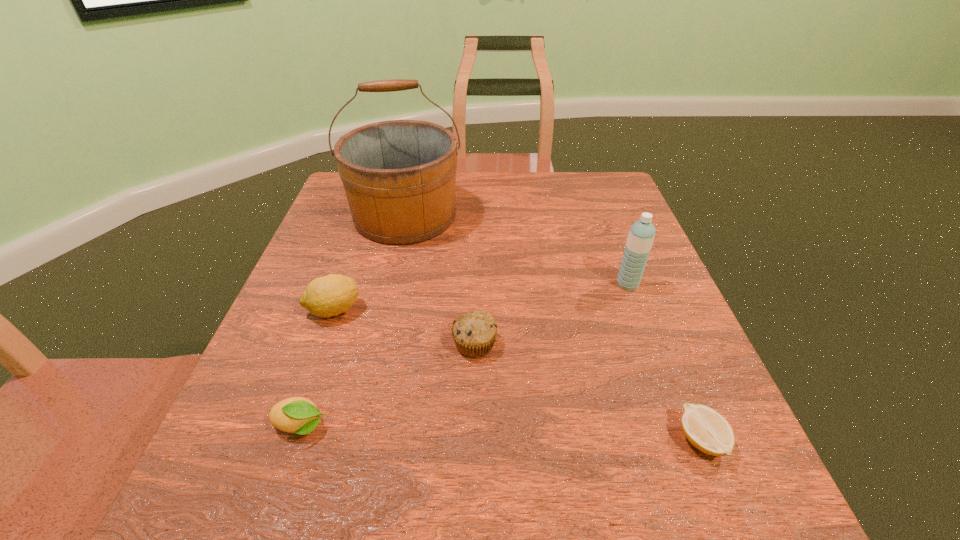
Locate an element on the screen. This screenshot has height=540, width=960. object that is at the far left corner is located at coordinates (399, 176).

The height and width of the screenshot is (540, 960). In the image, there is a desktop. In order to click on free space at the far edge in this screenshot , I will do `click(542, 204)`.

Identify the location of blank space at the near edge. The width and height of the screenshot is (960, 540). (554, 526).

Locate an element on the screen. The width and height of the screenshot is (960, 540). free space at the left edge is located at coordinates (351, 276).

Identify the location of vacant space at the right edge of the desktop. (614, 291).

Identify the location of vacant space at the far right corner of the desktop. (610, 197).

Identify the location of vacant area at the near right corner of the desktop. (693, 486).

I want to click on blank region between the farthest lemon and the rightmost lemon, so click(517, 375).

The image size is (960, 540). Find the location of `free space between the rightmost lemon and the fourth farthest object`. free space between the rightmost lemon and the fourth farthest object is located at coordinates (588, 392).

The height and width of the screenshot is (540, 960). I want to click on free spot between the muffin and the second shortest object, so click(x=388, y=385).